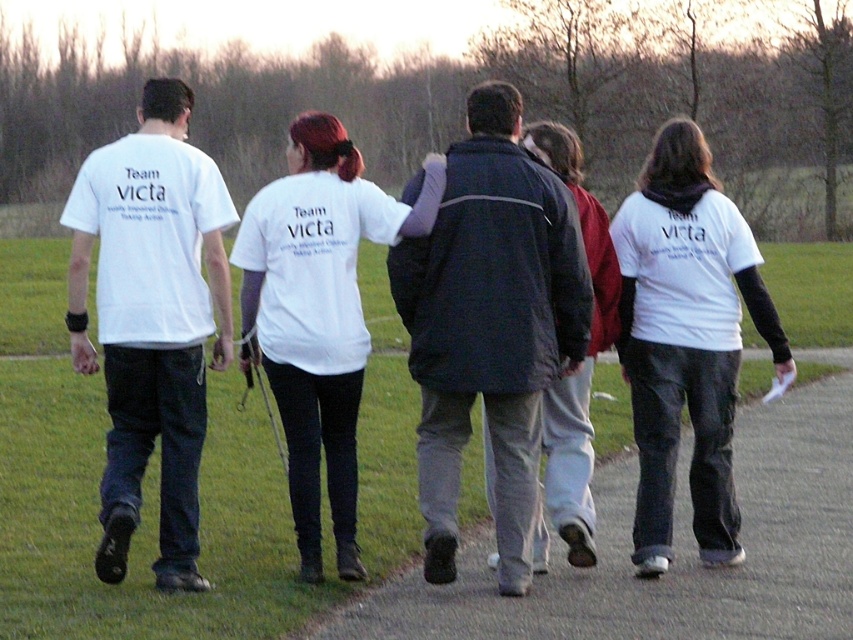
You are standing at the origin point of the coordinate system. Based on the scene, where is the smooth concrete pavement at center located?

The smooth concrete pavement at center is located at point (674, 548) in the 2D coordinate system.